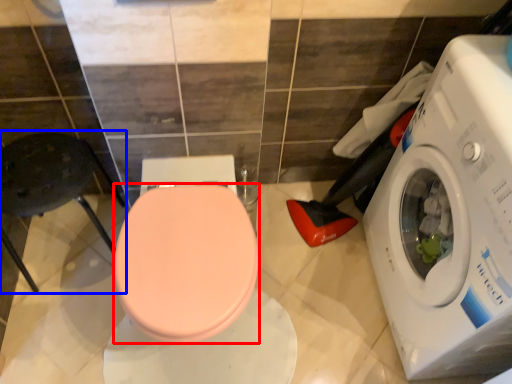
Question: Which object is further to the camera taking this photo, bidet (highlighted by a red box) or chair (highlighted by a blue box)?

Choices:
 (A) bidet
 (B) chair

Answer: (B)